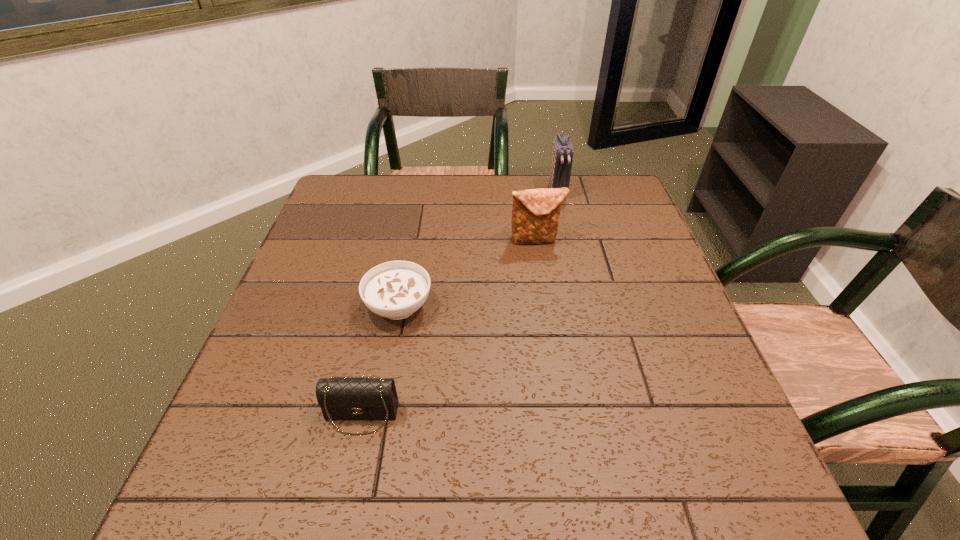
The image size is (960, 540). In order to click on clutch bag that is the second closest to the farthest object in this screenshot , I will do (x=341, y=398).